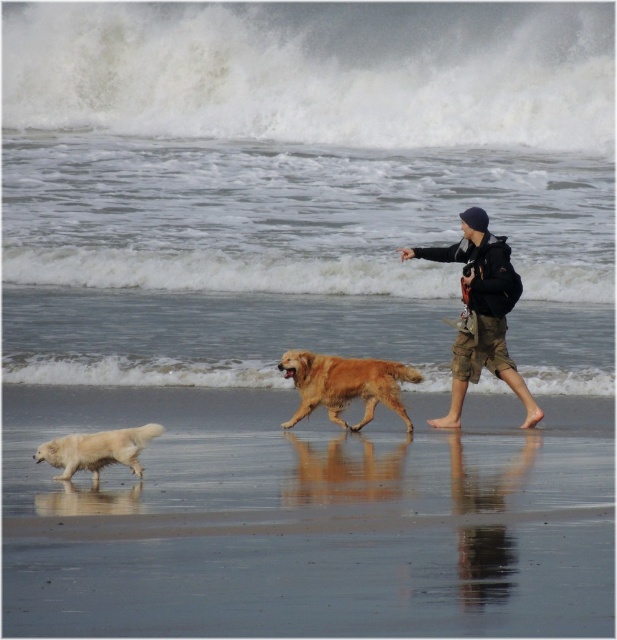
You are a photographer standing at the center of the beach scene. You want to take a photo that includes both the dark blue knit cap at upper right and the white fluffy dog at lower left. Given that your camera has a maximum zoom range that can capture objects up to 4 meters apart, will you be able to include both subjects in the same frame without moving?

The distance between the dark blue knit cap at upper right and the white fluffy dog at lower left is 3.97 meters, which is within the camera maximum zoom range of 4 meters. Therefore, you can capture both subjects in the same frame without moving.

You are standing on the beach and want to place a small flag at each of the two points marked in the image. The first point is at coordinate point (296, 384) and the second is at point (110, 433). If you want to place the flags so that one is closer to you and the other is further away, which point should each flag be placed at?

Place the flag at point (296, 384) closer to you and the flag at point (110, 433) further away because point (296, 384) is further to the camera than point (110, 433).

You are a photographer trying to capture a shot of the dark blue knit cap at upper right and the white fluffy dog at lower left. If you want to frame both subjects in the same photo without moving either, which one should you adjust the camera angle to focus on first, considering their sizes?

The dark blue knit cap at upper right might be wider than the white fluffy dog at lower left, so you should focus on the dark blue knit cap at upper right first to ensure it fits within the frame.